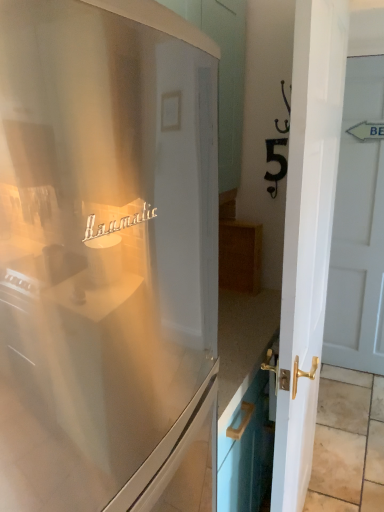
You are a GUI agent. You are given a task and a screenshot of the screen. Output one action in this format:
    pyautogui.click(x=<x>, y=<y>)
    Task: Click on the white glossy door at right, which appears as the 1th door when viewed from the back
    This screenshot has height=512, width=384.
    Given the screenshot: What is the action you would take?
    pyautogui.click(x=358, y=226)

This screenshot has width=384, height=512. What do you see at coordinates (107, 258) in the screenshot? I see `satin white refrigerator at center` at bounding box center [107, 258].

In order to click on white glossy door at right, placed as the 1th door when sorted from front to back in this screenshot , I will do `click(307, 236)`.

In terms of height, does satin white refrigerator at center look taller or shorter compared to white glossy door at right, the 1th door in the right-to-left sequence?

Considering their sizes, satin white refrigerator at center has less height than white glossy door at right, the 1th door in the right-to-left sequence.

Are satin white refrigerator at center and white glossy door at right, which is the 2th door from front to back, beside each other?

satin white refrigerator at center and white glossy door at right, which is the 2th door from front to back, are clearly separated.

Is satin white refrigerator at center shorter than white glossy door at right, which is the 2th door from back to front?

Yes.

Which object is thinner, satin white refrigerator at center or white glossy door at right, the second door in the right-to-left sequence?

white glossy door at right, the second door in the right-to-left sequence, is thinner.

Considering the sizes of objects satin white refrigerator at center and white glossy door at right, the second door in the right-to-left sequence, in the image provided, who is bigger, satin white refrigerator at center or white glossy door at right, the second door in the right-to-left sequence,?

satin white refrigerator at center is bigger.

From a real-world perspective, which is physically above, white glossy door at right, which is the 2th door from front to back, or satin white refrigerator at center?

satin white refrigerator at center is physically above.

Considering the relative sizes of white glossy door at right, which is the 2th door from front to back, and satin white refrigerator at center in the image provided, is white glossy door at right, which is the 2th door from front to back, bigger than satin white refrigerator at center?

No.

Based on their positions, is white glossy door at right, the 1th door in the right-to-left sequence, located to the left or right of satin white refrigerator at center?

Clearly, white glossy door at right, the 1th door in the right-to-left sequence, is on the right of satin white refrigerator at center in the image.

Based on their positions, is white glossy door at right, the second door in the right-to-left sequence, located to the left or right of satin white refrigerator at center?

In the image, white glossy door at right, the second door in the right-to-left sequence, appears on the right side of satin white refrigerator at center.

Can you confirm if white glossy door at right, which is the 2th door from back to front, is thinner than satin white refrigerator at center?

Yes, white glossy door at right, which is the 2th door from back to front, is thinner than satin white refrigerator at center.

Which is behind, white glossy door at right, which is counted as the first door, starting from the left, or satin white refrigerator at center?

white glossy door at right, which is counted as the first door, starting from the left, is more distant.

Where is `refrigerator below the white glossy door at right, which is the 2th door from back to front (from the image's perspective)`? The height and width of the screenshot is (512, 384). refrigerator below the white glossy door at right, which is the 2th door from back to front (from the image's perspective) is located at coordinates (107, 258).

From a real-world perspective, is white glossy door at right, acting as the second door starting from the left, positioned above or below white glossy door at right, placed as the 1th door when sorted from front to back?

In terms of real-world spatial position, white glossy door at right, acting as the second door starting from the left, is above white glossy door at right, placed as the 1th door when sorted from front to back.

Which point is more distant from viewer, (365,62) or (310,263)?

Positioned behind is point (365,62).

Is white glossy door at right, the 1th door in the right-to-left sequence, beside white glossy door at right, which is counted as the first door, starting from the left?

No, white glossy door at right, the 1th door in the right-to-left sequence, is not in contact with white glossy door at right, which is counted as the first door, starting from the left.

From the image's perspective, which is below, white glossy door at right, placed as the 1th door when sorted from front to back, or white glossy door at right, acting as the second door starting from the left?

white glossy door at right, placed as the 1th door when sorted from front to back, is shown below in the image.

Which object is more forward, white glossy door at right, placed as the 1th door when sorted from front to back, or white glossy door at right, which is the 2th door from front to back?

white glossy door at right, placed as the 1th door when sorted from front to back, is closer to the camera.

From a real-world perspective, who is located higher, white glossy door at right, which is the 2th door from back to front, or white glossy door at right, the 1th door in the right-to-left sequence?

From a 3D spatial view, white glossy door at right, the 1th door in the right-to-left sequence, is above.

Considering the sizes of objects white glossy door at right, the second door in the right-to-left sequence, and white glossy door at right, acting as the second door starting from the left, in the image provided, who is taller, white glossy door at right, the second door in the right-to-left sequence, or white glossy door at right, acting as the second door starting from the left,?

white glossy door at right, acting as the second door starting from the left.

Find the location of a particular element. refrigerator in front of the white glossy door at right, which is the 2th door from front to back is located at coordinates (107, 258).

Locate an element on the screen. This screenshot has height=512, width=384. door that is the 1st object located above the satin white refrigerator at center (from the image's perspective) is located at coordinates (307, 236).

Based on their spatial positions, is white glossy door at right, which is counted as the first door, starting from the left, or satin white refrigerator at center closer to white glossy door at right, acting as the second door starting from the left?

white glossy door at right, which is counted as the first door, starting from the left, is closer to white glossy door at right, acting as the second door starting from the left.

From the picture: Which object lies nearer to the anchor point white glossy door at right, acting as the second door starting from the left, satin white refrigerator at center or white glossy door at right, which is the 2th door from back to front?

white glossy door at right, which is the 2th door from back to front, is positioned closer to the anchor white glossy door at right, acting as the second door starting from the left.

Looking at the image, which one is located further to white glossy door at right, which is counted as the first door, starting from the left, white glossy door at right, which appears as the 1th door when viewed from the back, or satin white refrigerator at center?

Among the two, white glossy door at right, which appears as the 1th door when viewed from the back, is located further to white glossy door at right, which is counted as the first door, starting from the left.

Based on their spatial positions, is white glossy door at right, placed as the 1th door when sorted from front to back, or white glossy door at right, which is the 2th door from front to back, closer to satin white refrigerator at center?

white glossy door at right, placed as the 1th door when sorted from front to back.

Considering their positions, is white glossy door at right, the 1th door in the right-to-left sequence, positioned closer to satin white refrigerator at center than white glossy door at right, which is counted as the first door, starting from the left?

white glossy door at right, which is counted as the first door, starting from the left.

Estimate the real-world distances between objects in this image. Which object is further from white glossy door at right, which is counted as the first door, starting from the left, satin white refrigerator at center or white glossy door at right, which appears as the 1th door when viewed from the back?

The object further to white glossy door at right, which is counted as the first door, starting from the left, is white glossy door at right, which appears as the 1th door when viewed from the back.

Identify the location of door located between satin white refrigerator at center and white glossy door at right, acting as the second door starting from the left, in the depth direction. (307, 236).